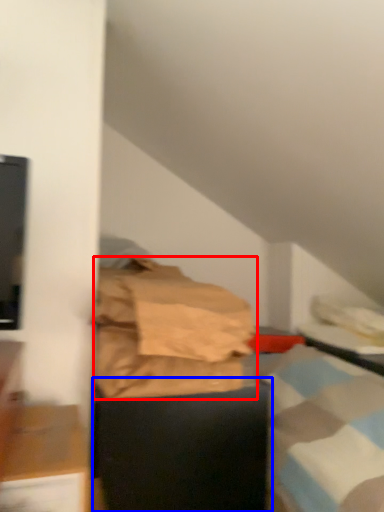
Question: Which of the following is the farthest to the observer, material (highlighted by a red box) or furniture (highlighted by a blue box)?

Choices:
 (A) material
 (B) furniture

Answer: (B)